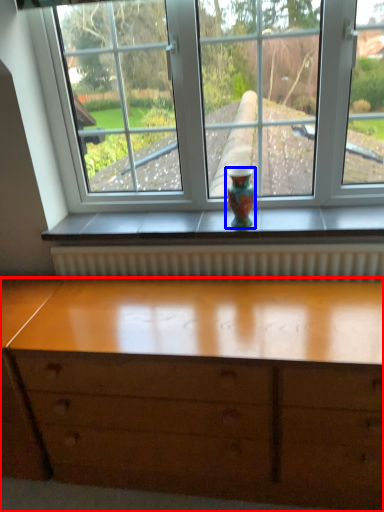
Question: Which object appears farthest to the camera in this image, chest of drawers (highlighted by a red box) or glass vase (highlighted by a blue box)?

Choices:
 (A) chest of drawers
 (B) glass vase

Answer: (B)